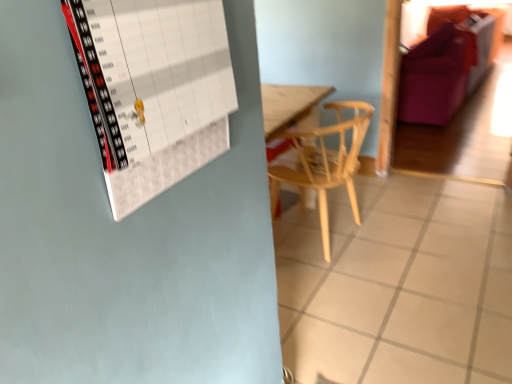
Question: Can you confirm if white paper calendar at upper left is taller than light wood chair at center?

Choices:
 (A) no
 (B) yes

Answer: (A)

Question: From the image's perspective, is white paper calendar at upper left on top of light wood chair at center?

Choices:
 (A) yes
 (B) no

Answer: (A)

Question: Can you confirm if white paper calendar at upper left is shorter than light wood chair at center?

Choices:
 (A) yes
 (B) no

Answer: (A)

Question: Can you confirm if white paper calendar at upper left is positioned to the left of light wood chair at center?

Choices:
 (A) no
 (B) yes

Answer: (B)

Question: Considering the relative sizes of white paper calendar at upper left and light wood chair at center in the image provided, is white paper calendar at upper left bigger than light wood chair at center?

Choices:
 (A) yes
 (B) no

Answer: (B)

Question: Is there a large distance between white paper calendar at upper left and light wood chair at center?

Choices:
 (A) yes
 (B) no

Answer: (A)

Question: Is light wood chair at center smaller than white tile at center?

Choices:
 (A) no
 (B) yes

Answer: (A)

Question: Is light wood chair at center located outside white tile at center?

Choices:
 (A) yes
 (B) no

Answer: (A)

Question: Can white tile at center be found inside light wood chair at center?

Choices:
 (A) no
 (B) yes

Answer: (A)

Question: Would you consider light wood chair at center to be distant from white tile at center?

Choices:
 (A) no
 (B) yes

Answer: (A)

Question: From a real-world perspective, is light wood chair at center physically below white tile at center?

Choices:
 (A) yes
 (B) no

Answer: (B)

Question: From a real-world perspective, is light wood chair at center on white tile at center?

Choices:
 (A) no
 (B) yes

Answer: (B)

Question: Is the position of purple fabric couch at upper right less distant than that of white paper calendar at upper left?

Choices:
 (A) yes
 (B) no

Answer: (B)